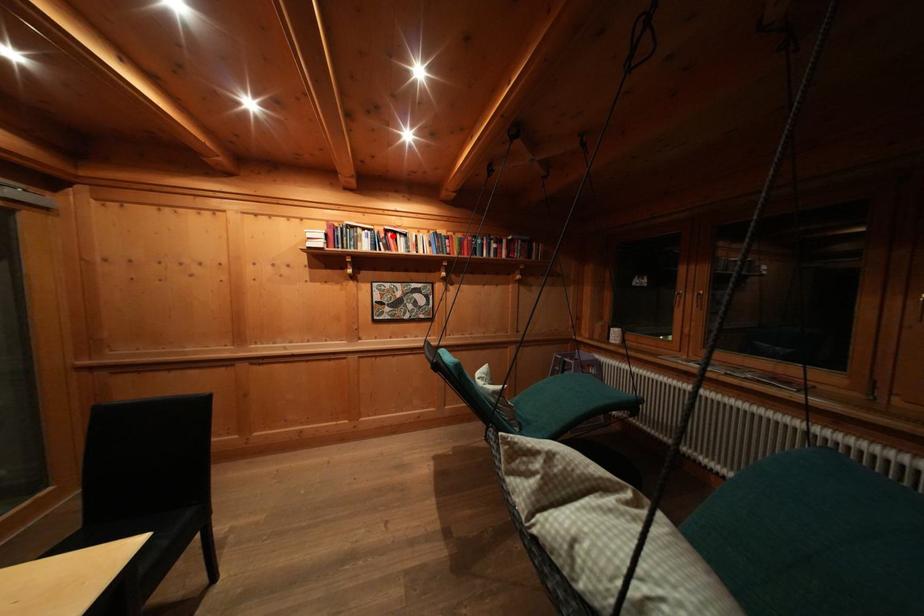
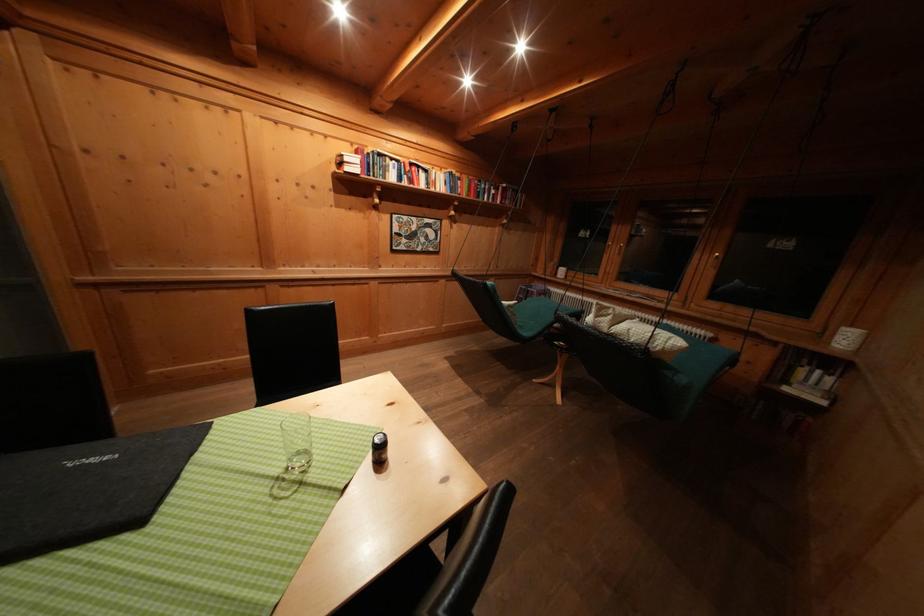
Locate, in the second image, the point that corresponds to the highlighted location in the first image.

(418, 169)